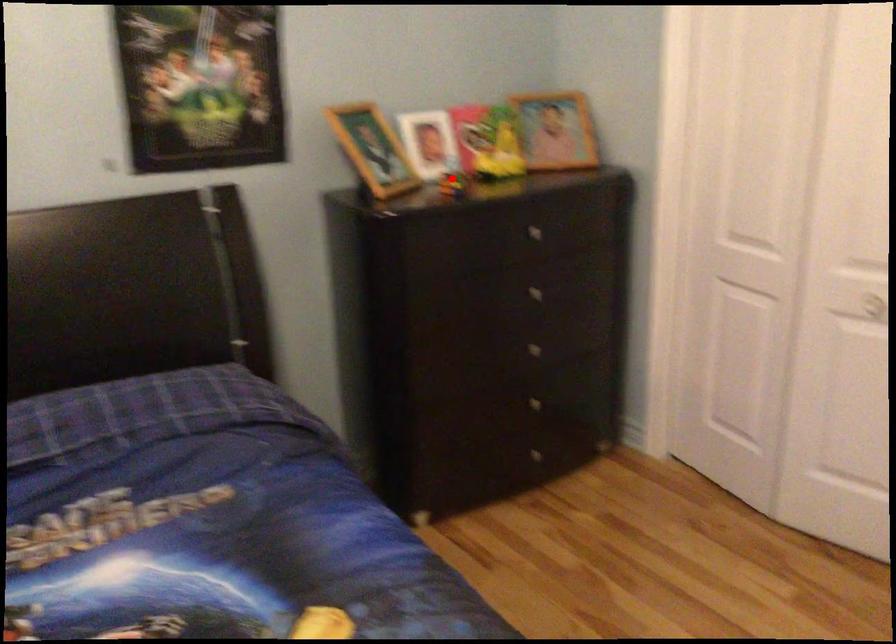
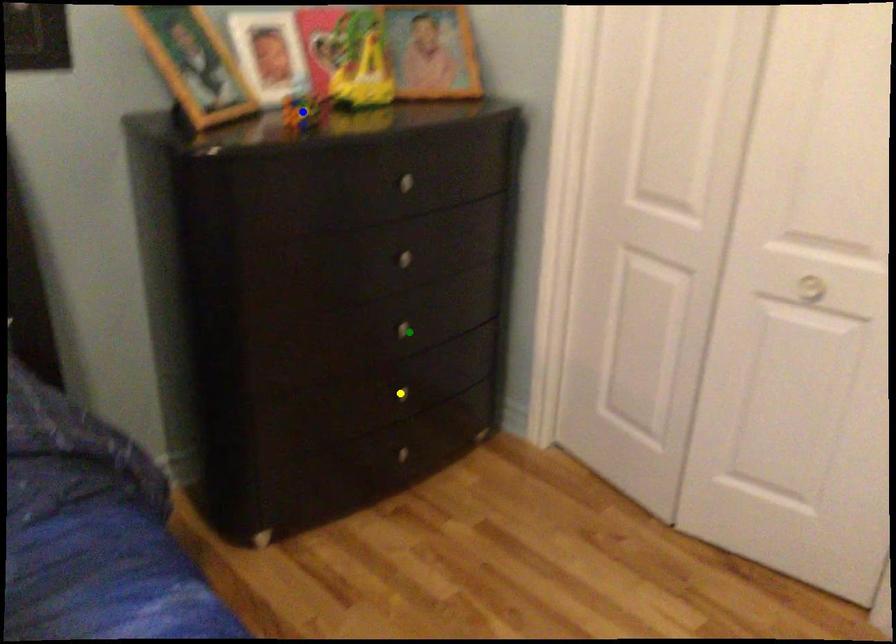
Question: I am providing you with two images of the same scene from different viewpoints. A red point is marked on the first image. You are given multiple points on the second image. In image 2, which mark is for the same physical point as the one in image 1?

Choices:
 (A) blue point
 (B) green point
 (C) yellow point

Answer: (A)